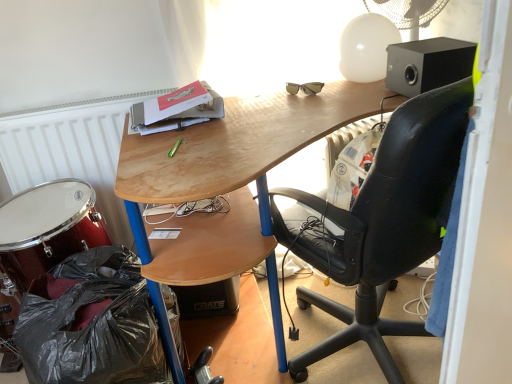
Question: From the image's perspective, is white plastic mechanical fan at upper right positioned above or below black plastic bag at lower left?

Choices:
 (A) above
 (B) below

Answer: (A)

Question: Considering the positions of point (437, 6) and point (78, 340), is point (437, 6) closer or farther from the camera than point (78, 340)?

Choices:
 (A) closer
 (B) farther

Answer: (B)

Question: Based on their relative distances, which object is farther from the shiny red drum at lower left?

Choices:
 (A) white plastic mechanical fan at upper right
 (B) black leather chair at upper right
 (C) matte black speaker at upper right
 (D) wooden desk at upper center
 (E) white matte radiator at left

Answer: (A)

Question: Which object is the closest to the white matte radiator at left?

Choices:
 (A) shiny red drum at lower left
 (B) black plastic bag at lower left
 (C) white plastic mechanical fan at upper right
 (D) wooden desk at upper center
 (E) black leather chair at upper right

Answer: (A)